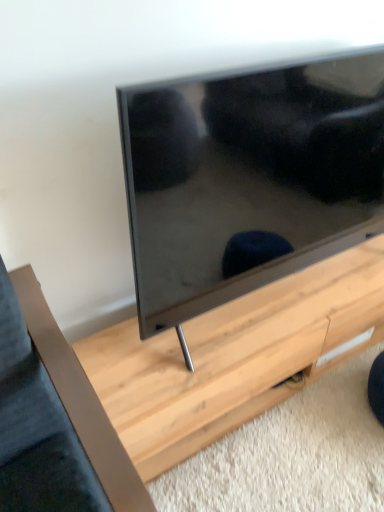
Question: Is matte black tv at center bigger or smaller than light wood table at center?

Choices:
 (A) small
 (B) big

Answer: (B)

Question: From the image's perspective, is matte black tv at center positioned above or below light wood table at center?

Choices:
 (A) below
 (B) above

Answer: (B)

Question: Considering the relative positions of matte black tv at center and light wood table at center in the image provided, is matte black tv at center to the left or to the right of light wood table at center?

Choices:
 (A) left
 (B) right

Answer: (A)

Question: Is point (365, 256) closer or farther from the camera than point (228, 169)?

Choices:
 (A) farther
 (B) closer

Answer: (A)

Question: From the image's perspective, relative to matte black tv at center, is light wood table at center above or below?

Choices:
 (A) below
 (B) above

Answer: (A)

Question: Considering the relative positions of light wood table at center and matte black tv at center in the image provided, is light wood table at center to the left or to the right of matte black tv at center?

Choices:
 (A) right
 (B) left

Answer: (A)

Question: From their relative heights in the image, would you say light wood table at center is taller or shorter than matte black tv at center?

Choices:
 (A) tall
 (B) short

Answer: (B)